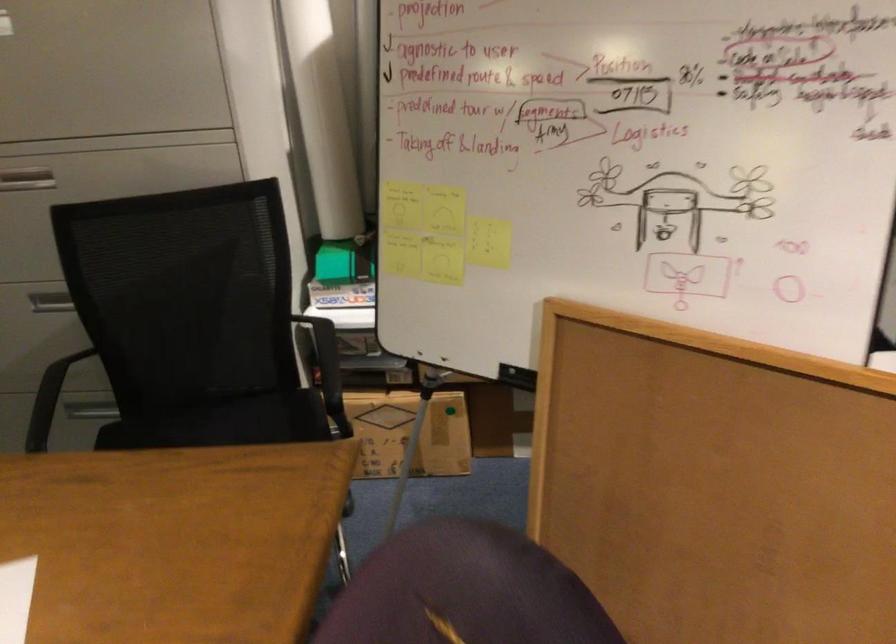
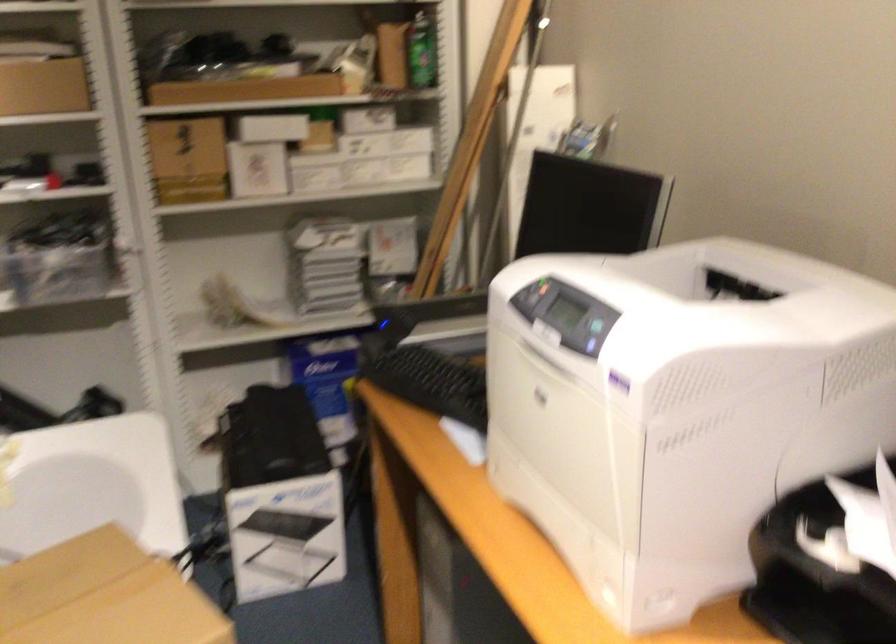
What movement of the cameraman would produce the second image?

The cameraman walked toward right, backward.